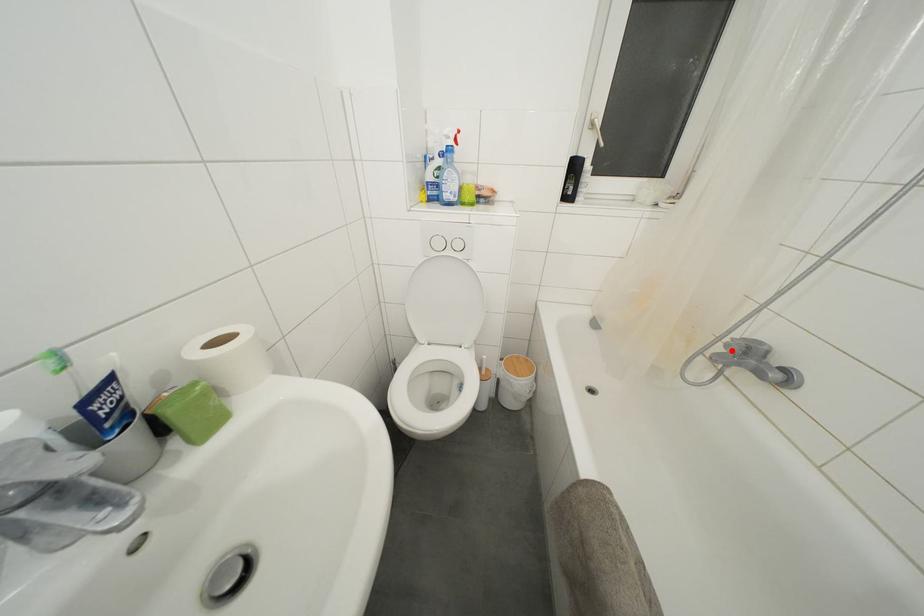
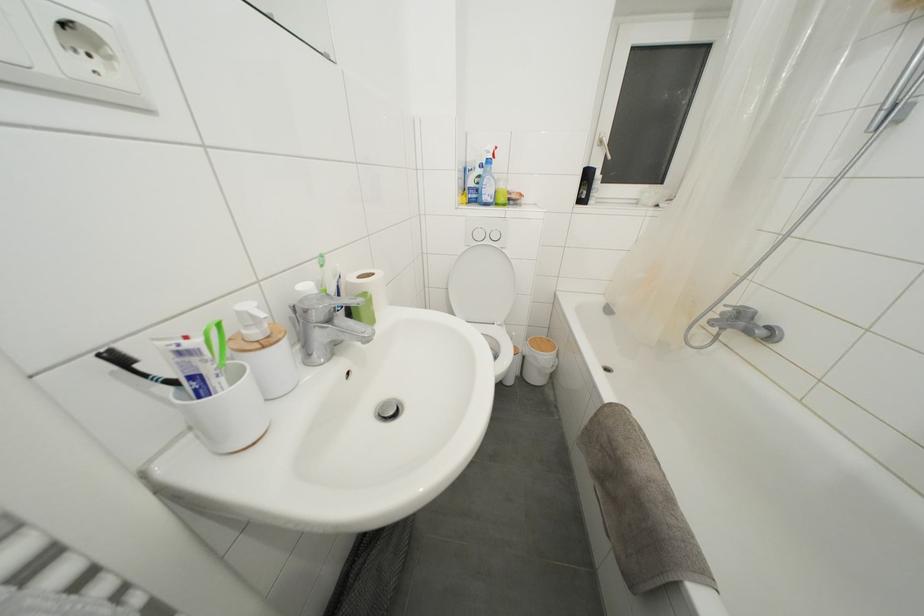
Locate, in the second image, the point that corresponds to the highlighted location in the first image.

(726, 318)